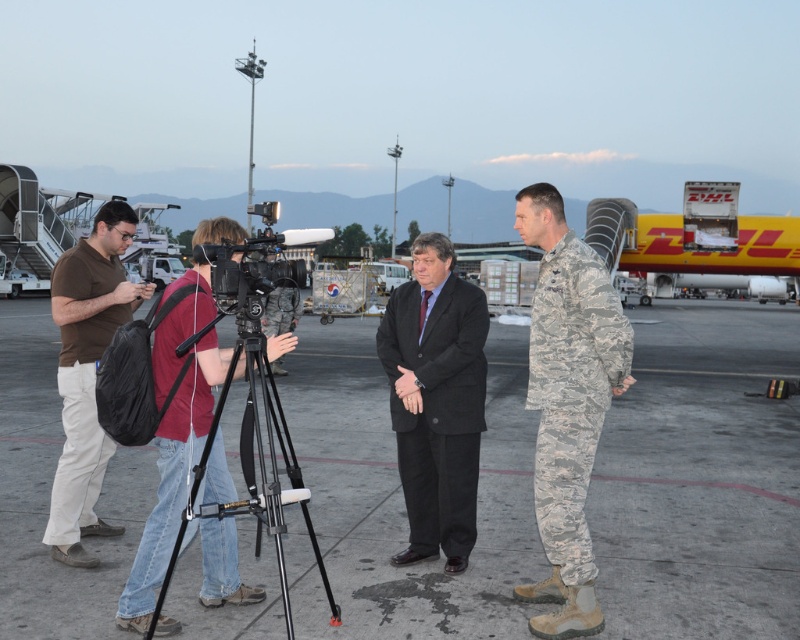
Which is in front, point (160, 522) or point (254, 326)?

Point (254, 326)

The width and height of the screenshot is (800, 640). In order to click on camouflage fabric uniform at center in this screenshot , I will do tap(162, 512).

Can you confirm if gray concrete tarmac at center is wider than dark gray wool suit at center?

Yes, gray concrete tarmac at center is wider than dark gray wool suit at center.

Is gray concrete tarmac at center behind dark gray wool suit at center?

No, gray concrete tarmac at center is in front of dark gray wool suit at center.

Identify the location of gray concrete tarmac at center. (701, 477).

Is gray concrete tarmac at center behind brown cotton shirt at left?

No, gray concrete tarmac at center is closer to the viewer.

Can you confirm if gray concrete tarmac at center is positioned above brown cotton shirt at left?

Incorrect, gray concrete tarmac at center is not positioned above brown cotton shirt at left.

The height and width of the screenshot is (640, 800). What do you see at coordinates (701, 477) in the screenshot?
I see `gray concrete tarmac at center` at bounding box center [701, 477].

In order to click on gray concrete tarmac at center in this screenshot , I will do `click(701, 477)`.